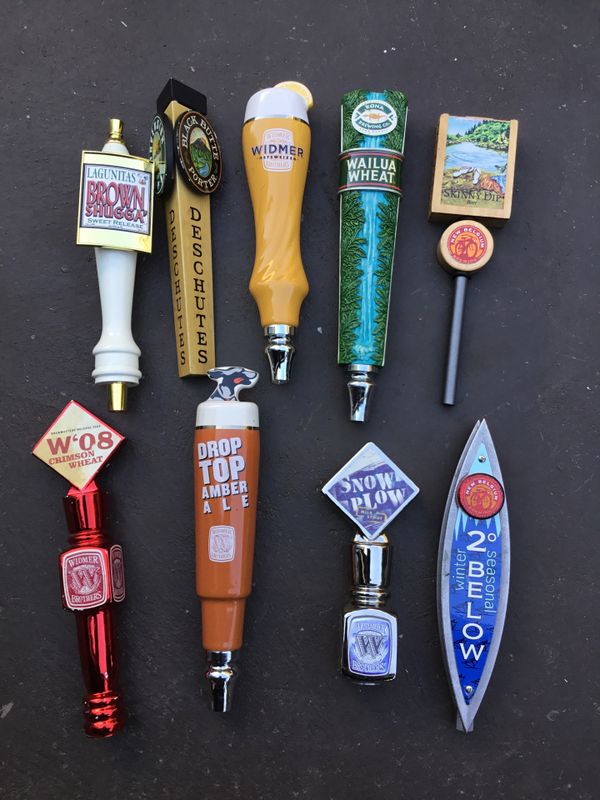
Identify the location of tap. This screenshot has height=800, width=600. (78, 534), (216, 517), (369, 550), (453, 553), (471, 172), (364, 182), (253, 188), (188, 205), (130, 212).